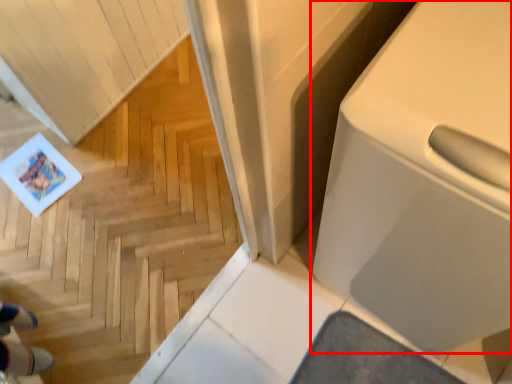
Question: From the image's perspective, considering the relative positions of home appliance (annotated by the red box) and stairwell in the image provided, where is home appliance (annotated by the red box) located with respect to the staircase?

Choices:
 (A) below
 (B) above

Answer: (B)